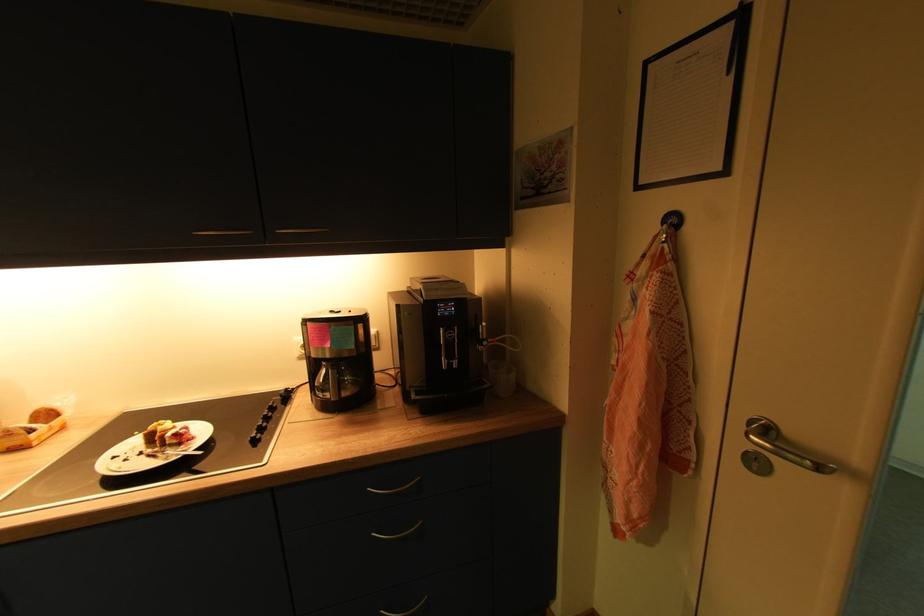
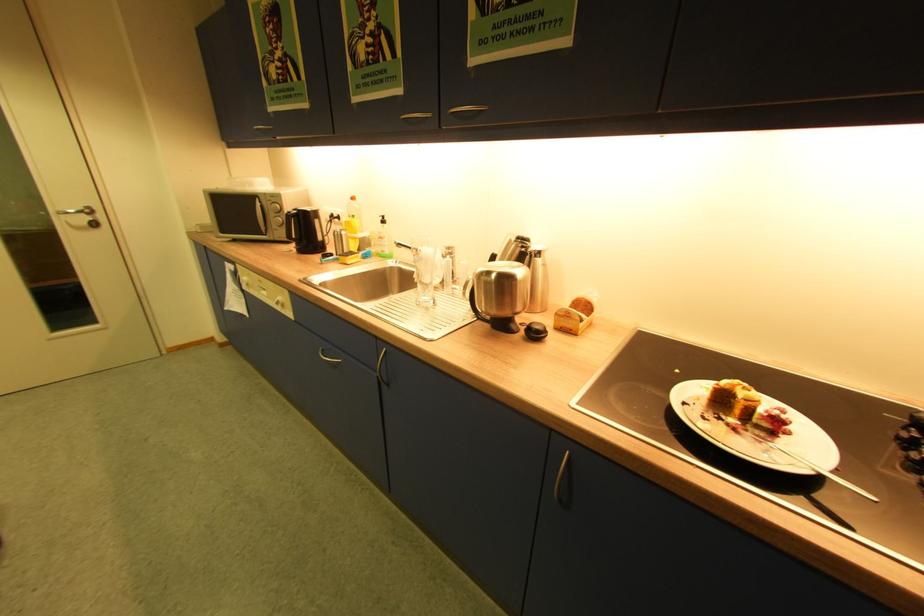
In the second image, find the point that corresponds to (164,456) in the first image.

(746, 432)